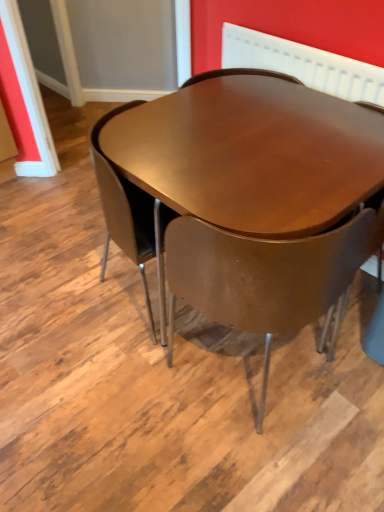
Describe the element at coordinates (245, 157) in the screenshot. I see `shiny brown table at center` at that location.

Measure the distance between point (298,219) and camera.

A distance of 1.04 meters exists between point (298,219) and camera.

What is the approximate height of matte brown chair at center?

The height of matte brown chair at center is 30.23 inches.

Where is `shiny brown table at center`? Image resolution: width=384 pixels, height=512 pixels. shiny brown table at center is located at coordinates (245, 157).

Can you confirm if matte brown chair at center is smaller than white textured radiator at upper center?

No, matte brown chair at center is not smaller than white textured radiator at upper center.

How distant is matte brown chair at center from white textured radiator at upper center?

A distance of 31.89 inches exists between matte brown chair at center and white textured radiator at upper center.

Considering the sizes of matte brown chair at center and white textured radiator at upper center in the image, is matte brown chair at center taller or shorter than white textured radiator at upper center?

Considering their sizes, matte brown chair at center has more height than white textured radiator at upper center.

From a real-world perspective, is matte brown chair at center physically located above or below white textured radiator at upper center?

From a real-world perspective, matte brown chair at center is physically below white textured radiator at upper center.

From a real-world perspective, which is physically below, shiny brown table at center or matte brown chair at center?

shiny brown table at center.

From the image's perspective, is shiny brown table at center beneath matte brown chair at center?

No, from the image's perspective, shiny brown table at center is not beneath matte brown chair at center.

In terms of width, does shiny brown table at center look wider or thinner when compared to matte brown chair at center?

In the image, shiny brown table at center appears to be wider than matte brown chair at center.

In the scene shown: Is shiny brown table at center next to white textured radiator at upper center and touching it?

No, shiny brown table at center is not in contact with white textured radiator at upper center.

Who is shorter, shiny brown table at center or white textured radiator at upper center?

With less height is white textured radiator at upper center.

From the image's perspective, who appears lower, shiny brown table at center or white textured radiator at upper center?

shiny brown table at center, from the image's perspective.

Considering the sizes of white textured radiator at upper center and shiny brown table at center in the image, is white textured radiator at upper center taller or shorter than shiny brown table at center?

Considering their sizes, white textured radiator at upper center has less height than shiny brown table at center.

Does point (320, 69) appear closer or farther from the camera than point (280, 73)?

Point (320, 69) is closer to the camera than point (280, 73).

How distant is white textured radiator at upper center from shiny brown table at center?

white textured radiator at upper center is 38.92 centimeters from shiny brown table at center.

From the image's perspective, which one is positioned lower, white textured radiator at upper center or shiny brown table at center?

shiny brown table at center appears lower in the image.

Does white textured radiator at upper center have a greater width compared to matte brown chair at center?

No, white textured radiator at upper center is not wider than matte brown chair at center.

Based on their sizes in the image, would you say white textured radiator at upper center is bigger or smaller than matte brown chair at center?

Considering their sizes, white textured radiator at upper center takes up less space than matte brown chair at center.

Looking at this image, considering the sizes of objects white textured radiator at upper center and matte brown chair at center in the image provided, who is shorter, white textured radiator at upper center or matte brown chair at center?

white textured radiator at upper center is shorter.

Is white textured radiator at upper center situated inside matte brown chair at center or outside?

white textured radiator at upper center is not inside matte brown chair at center, it's outside.

Relative to shiny brown table at center, is matte brown chair at center in front or behind?

In the image, matte brown chair at center appears in front of shiny brown table at center.

Could you tell me if matte brown chair at center is turned towards shiny brown table at center?

Yes, matte brown chair at center is turned towards shiny brown table at center.

Is matte brown chair at center taller or shorter than shiny brown table at center?

Clearly, matte brown chair at center is taller compared to shiny brown table at center.

Can you confirm if matte brown chair at center is positioned to the right of shiny brown table at center?

Yes, matte brown chair at center is to the right of shiny brown table at center.

Locate an element on the screen. This screenshot has height=512, width=384. chair directly beneath the white textured radiator at upper center (from a real-world perspective) is located at coordinates (267, 278).

I want to click on chair on the right of shiny brown table at center, so click(267, 278).

When comparing their distances from white textured radiator at upper center, does matte brown chair at center or shiny brown table at center seem further?

Based on the image, matte brown chair at center appears to be further to white textured radiator at upper center.

When comparing their distances from matte brown chair at center, does shiny brown table at center or white textured radiator at upper center seem closer?

shiny brown table at center lies closer to matte brown chair at center than the other object.

Consider the image. From the image, which object appears to be farther from white textured radiator at upper center, shiny brown table at center or matte brown chair at center?

matte brown chair at center is positioned further to the anchor white textured radiator at upper center.

Based on their spatial positions, is white textured radiator at upper center or matte brown chair at center closer to shiny brown table at center?

matte brown chair at center is closer to shiny brown table at center.

Looking at the image, which one is located further to shiny brown table at center, matte brown chair at center or white textured radiator at upper center?

white textured radiator at upper center is positioned further to the anchor shiny brown table at center.

Estimate the real-world distances between objects in this image. Which object is closer to matte brown chair at center, white textured radiator at upper center or shiny brown table at center?

shiny brown table at center is closer to matte brown chair at center.

Locate an element on the screen. table between white textured radiator at upper center and matte brown chair at center vertically is located at coordinates (245, 157).